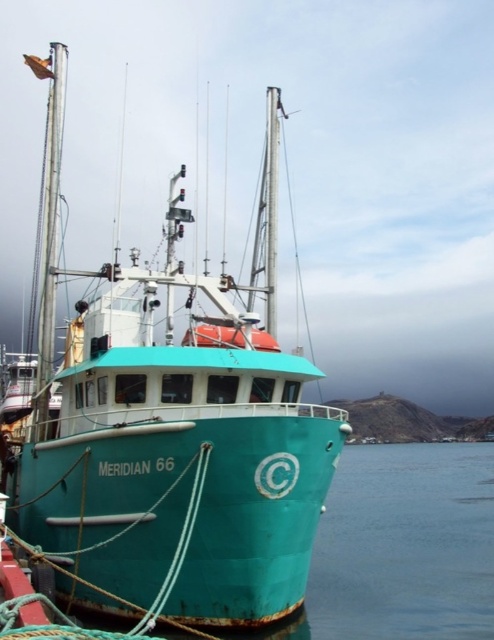
In the scene shown: You are a marine biologist planning to board the teal matte boat at center to conduct research. However, you notice there is also a teal rubber boat at center nearby. How far apart are these two boats from each other?

The teal matte boat at center is 36.57 meters from the teal rubber boat at center.

You are a marine biologist who needs to board the teal matte boat at center and the teal rubber boat at center to collect samples. Which boat should you board first if you want to start with the smaller vessel?

You should board the teal matte boat at center first because it is smaller than the teal rubber boat at center according to the description.